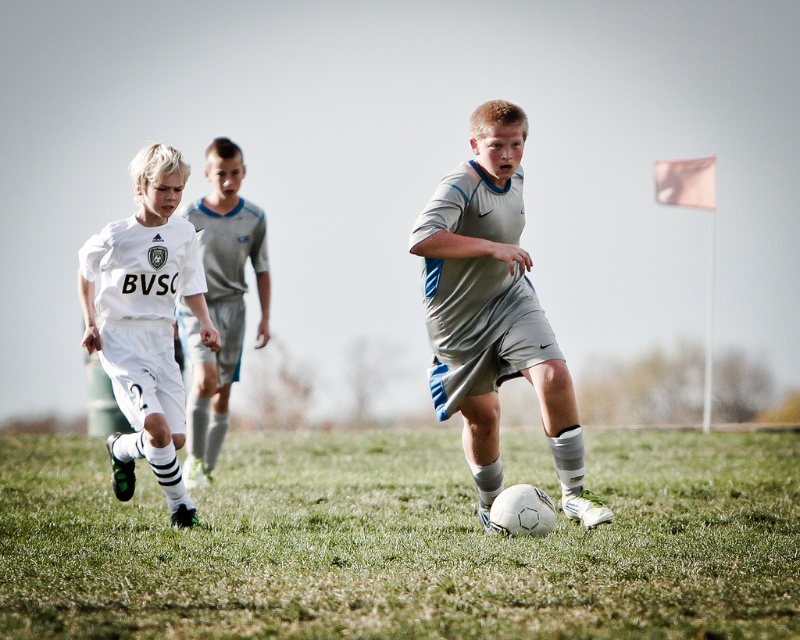
Describe the element at coordinates (494, 312) in the screenshot. Image resolution: width=800 pixels, height=640 pixels. I see `gray matte shorts at center` at that location.

Between gray matte shorts at center and white matte soccer uniform at left, which one has more height?

gray matte shorts at center

Identify the location of gray matte shorts at center. The height and width of the screenshot is (640, 800). (494, 312).

Does green grass at center appear under gray matte shorts at center?

Yes.

Who is positioned more to the right, green grass at center or gray matte shorts at center?

gray matte shorts at center is more to the right.

Image resolution: width=800 pixels, height=640 pixels. Describe the element at coordinates (404, 541) in the screenshot. I see `green grass at center` at that location.

The height and width of the screenshot is (640, 800). In order to click on green grass at center in this screenshot , I will do `click(404, 541)`.

In the scene shown: Does white matte soccer uniform at left appear on the right side of white matte soccer jersey at left?

No, white matte soccer uniform at left is not to the right of white matte soccer jersey at left.

Does white matte soccer uniform at left have a lesser width compared to white matte soccer jersey at left?

No, white matte soccer uniform at left is not thinner than white matte soccer jersey at left.

Is point (144, 349) closer to viewer compared to point (262, 337)?

Yes, point (144, 349) is closer to viewer.

You are a GUI agent. You are given a task and a screenshot of the screen. Output one action in this format:
    pyautogui.click(x=<x>, y=<y>)
    Task: Click on the white matte soccer uniform at left
    Image resolution: width=800 pixels, height=640 pixels.
    Given the screenshot: What is the action you would take?
    pyautogui.click(x=145, y=321)